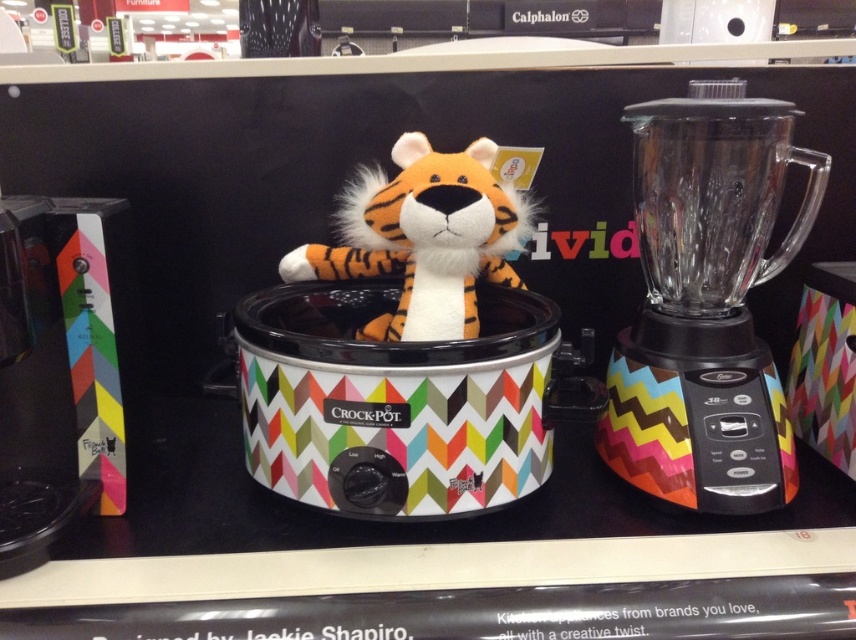
Question: Which point is closer to the camera?

Choices:
 (A) (397, 232)
 (B) (682, 372)
 (C) (531, 456)

Answer: (C)

Question: Does matte plastic crock pot at center have a larger size compared to clear glass blender at right?

Choices:
 (A) no
 (B) yes

Answer: (B)

Question: Is matte plastic crock pot at center further to the viewer compared to clear glass blender at right?

Choices:
 (A) yes
 (B) no

Answer: (B)

Question: Which object is farther from the camera taking this photo?

Choices:
 (A) clear glass blender at right
 (B) matte plastic crock pot at center
 (C) orange plush tiger at center

Answer: (C)

Question: Is matte plastic crock pot at center to the right of clear glass blender at right from the viewer's perspective?

Choices:
 (A) no
 (B) yes

Answer: (A)

Question: Which of the following is the farthest from the observer?

Choices:
 (A) (266, 456)
 (B) (684, 458)

Answer: (A)